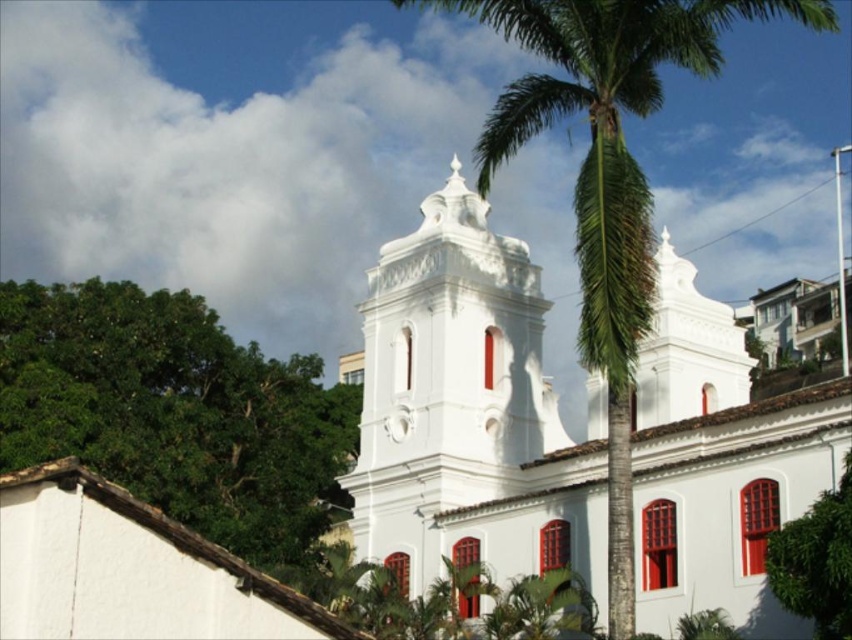
You are standing in front of the main building and want to take a photo that includes both the green leafy tree at left and the green leafy tree at center. Which tree should you position closer to the camera to ensure both are in frame?

To include both the green leafy tree at left and the green leafy tree at center in the photo, position the green leafy tree at left closer to the camera since it is already to the left of the green leafy tree at center.